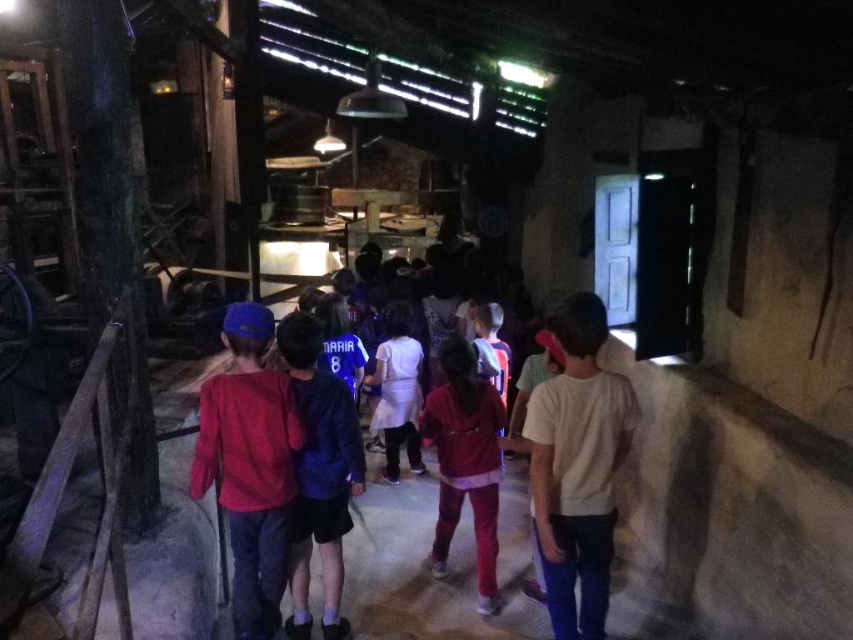
Question: Where is matte red shirt at center located in relation to blue jersey at center in the image?

Choices:
 (A) below
 (B) above

Answer: (B)

Question: Among these objects, which one is farthest from the camera?

Choices:
 (A) blue jersey at center
 (B) velvet red jacket at center

Answer: (B)

Question: Which of these objects is positioned farthest from the white matte shirt at center?

Choices:
 (A) blue jersey at center
 (B) matte red shirt at center
 (C) velvet red jacket at center

Answer: (B)

Question: Does blue jersey at center come behind white cotton dress at center?

Choices:
 (A) yes
 (B) no

Answer: (B)

Question: Is matte red shirt at center bigger than velvet red jacket at center?

Choices:
 (A) no
 (B) yes

Answer: (B)

Question: Which object appears closest to the camera in this image?

Choices:
 (A) white matte shirt at center
 (B) matte red shirt at center

Answer: (A)